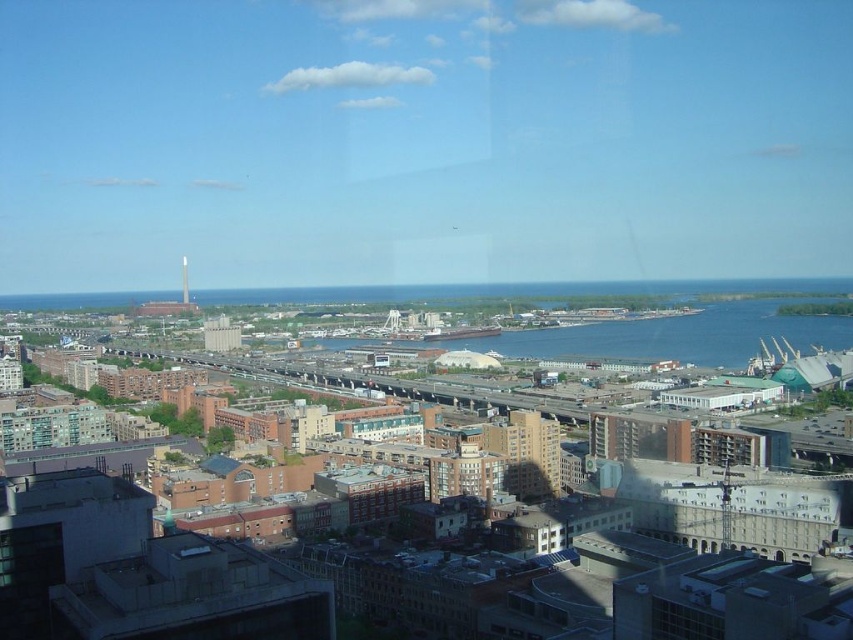
You are standing at the city park and want to take a photo of both the beige concrete building at center and the white glossy tower at center. Which one should you zoom in on first to ensure both are in focus?

You should zoom in on the beige concrete building at center first because it is closer to you than the white glossy tower at center, so adjusting focus starting from the closer object ensures both will be in focus.

You are an architect evaluating the cityscape. You need to determine which of the two structures, the beige concrete building at center or the white glossy tower at center, has a greater height for a potential rooftop project. Based on the scene, which one should you choose?

The beige concrete building at center is taller than the white glossy tower at center, so you should choose the beige concrete building at center for the rooftop project.